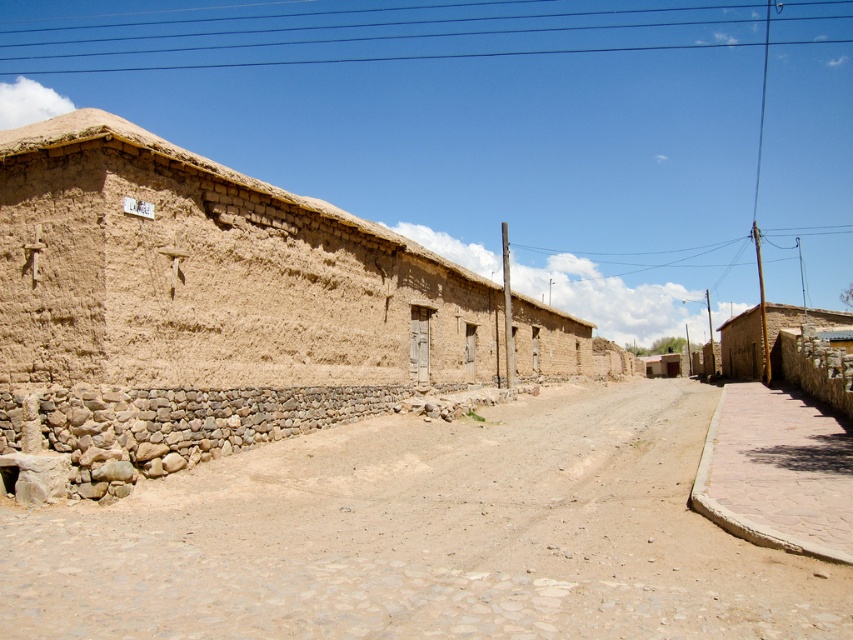
Question: In this image, where is brown dirt track at center located relative to brown mud hut at left?

Choices:
 (A) above
 (B) below

Answer: (B)

Question: Considering the relative positions of brown dirt track at center and brown adobe hut at right in the image provided, where is brown dirt track at center located with respect to brown adobe hut at right?

Choices:
 (A) right
 (B) left

Answer: (B)

Question: Is brown mud hut at left thinner than smooth concrete alley at lower right?

Choices:
 (A) yes
 (B) no

Answer: (B)

Question: Which point is farther to the camera?

Choices:
 (A) 50,355
 (B) 782,481

Answer: (A)

Question: Among these objects, which one is farthest from the camera?

Choices:
 (A) smooth concrete alley at lower right
 (B) brown mud hut at left

Answer: (B)

Question: Estimate the real-world distances between objects in this image. Which object is closer to the smooth concrete alley at lower right?

Choices:
 (A) brown dirt track at center
 (B) brown adobe hut at right

Answer: (A)